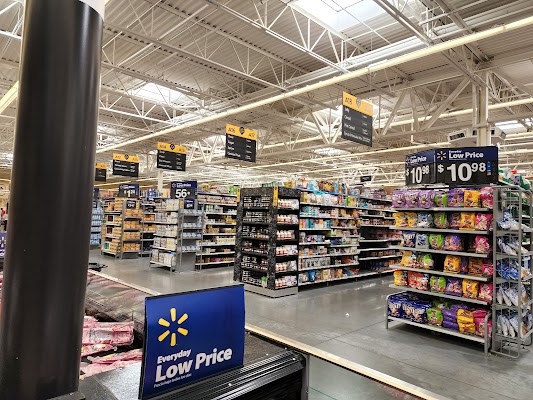
You are a GUI agent. You are given a task and a screenshot of the screen. Output one action in this format:
    pyautogui.click(x=<x>, y=<y>)
    Task: Click on the ceiling supports
    
    Given the screenshot: What is the action you would take?
    pyautogui.click(x=212, y=61), pyautogui.click(x=269, y=27), pyautogui.click(x=411, y=24), pyautogui.click(x=142, y=115), pyautogui.click(x=124, y=128)